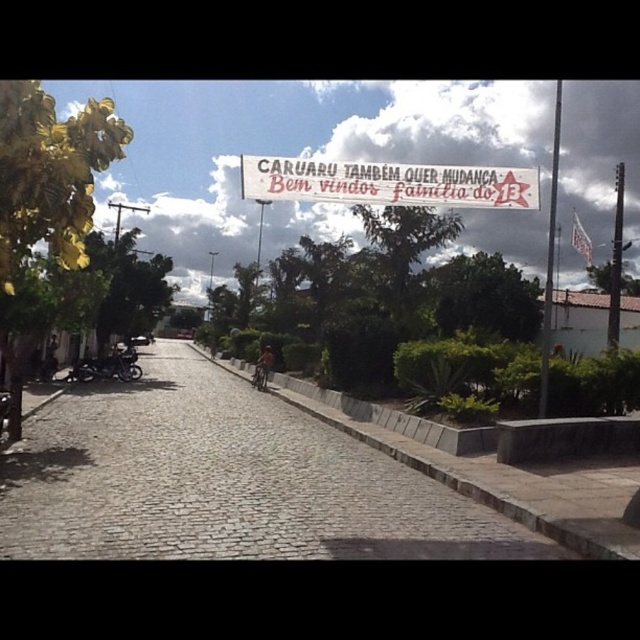
Does cobblestone pavement at center appear on the left side of white paper banner at center?

Yes, cobblestone pavement at center is to the left of white paper banner at center.

Which is in front, point (138, 440) or point (513, 208)?

Point (513, 208) is more forward.

Image resolution: width=640 pixels, height=640 pixels. In order to click on cobblestone pavement at center in this screenshot , I will do `click(225, 481)`.

Is point (268, 508) less distant than point (74, 378)?

Yes.

Can you confirm if cobblestone pavement at center is positioned below shiny black motorcycle at left?

Yes.

Who is more forward, (x=225, y=428) or (x=140, y=378)?

Positioned in front is point (x=225, y=428).

Image resolution: width=640 pixels, height=640 pixels. I want to click on cobblestone pavement at center, so click(225, 481).

Can you confirm if white paper banner at center is positioned below shiny black motorcycle at left?

No, white paper banner at center is not below shiny black motorcycle at left.

Does point (484, 195) come in front of point (90, 358)?

Yes, it is.

Between point (406, 188) and point (109, 356), which one is positioned behind?

Point (109, 356)

At what (x,y) coordinates should I click in order to perform the action: click on white paper banner at center. Please return your answer as a coordinate pair (x, y). This screenshot has width=640, height=640. Looking at the image, I should click on (387, 182).